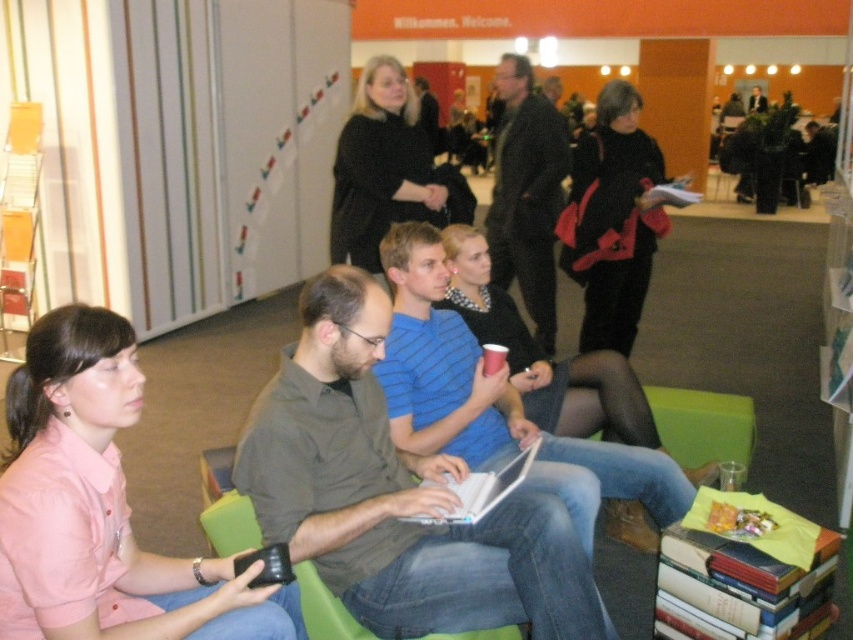
Question: Which point is farther to the camera?

Choices:
 (A) (332, 168)
 (B) (553, 202)
 (C) (578, 273)
 (D) (235, 492)

Answer: (A)

Question: Considering the real-world distances, which object is farthest from the black matte jacket at upper center?

Choices:
 (A) pink fabric shirt at lower left
 (B) dark gray jacket at center
 (C) white plastic laptop at center
 (D) green fabric chair at center

Answer: (A)

Question: Which point is farther from the camera taking this photo?

Choices:
 (A) (389, 556)
 (B) (511, 90)

Answer: (B)

Question: Can you confirm if dark gray jacket at center is smaller than green fabric chair at center?

Choices:
 (A) yes
 (B) no

Answer: (B)

Question: Is black matte jacket at upper center closer to camera compared to green fabric chair at center?

Choices:
 (A) no
 (B) yes

Answer: (A)

Question: Can you confirm if pink fabric shirt at lower left is positioned above green fabric chair at center?

Choices:
 (A) yes
 (B) no

Answer: (A)